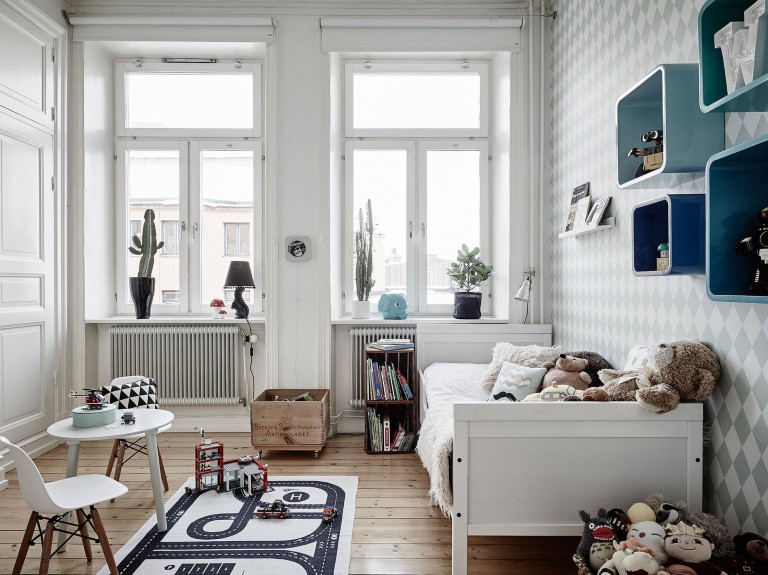
What are the coordinates of `white and gray diamond designed wall` in the screenshot? It's located at (590, 111).